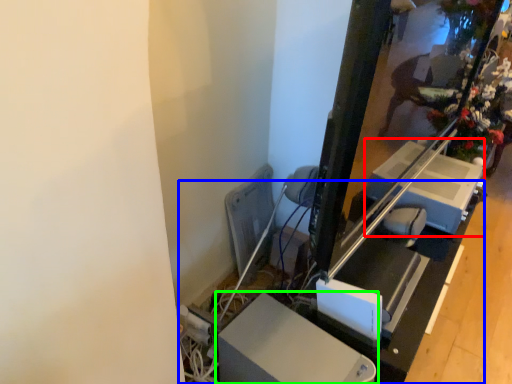
Question: Which object is the closest to the lift (highlighted by a red box)? Choose among these: table (highlighted by a blue box) or furniture (highlighted by a green box).

Choices:
 (A) table
 (B) furniture

Answer: (A)